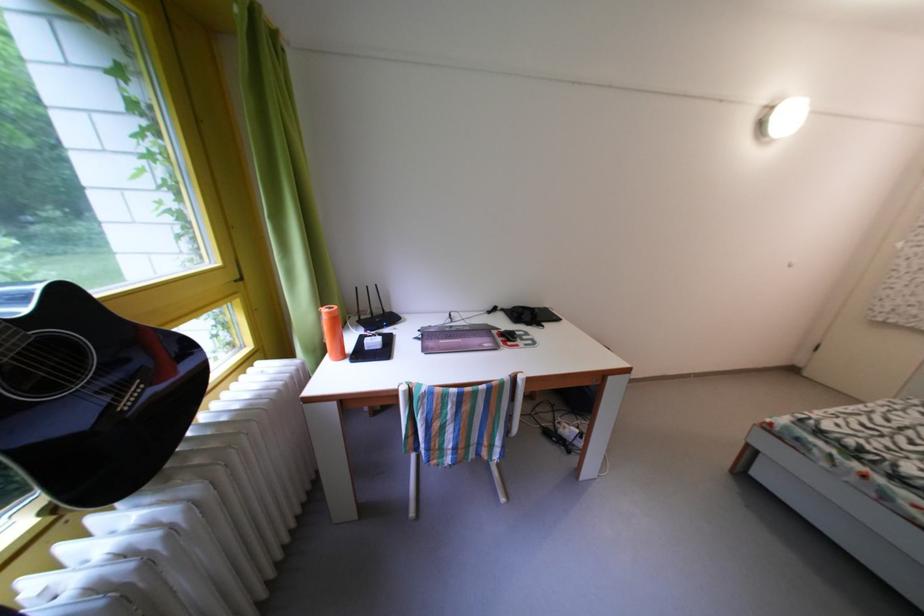
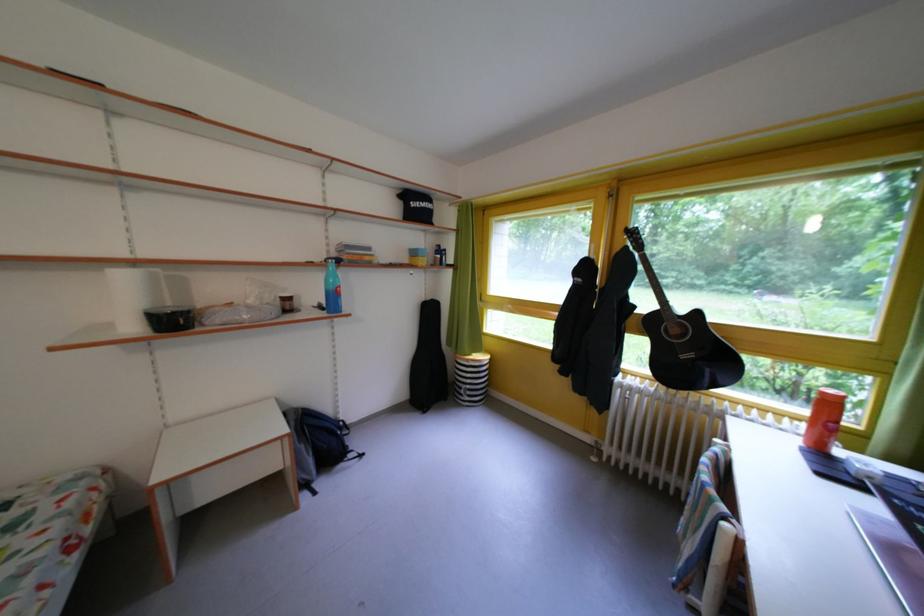
Where in the second image is the point corresponding to the point at 338,318 from the first image?

(833, 399)